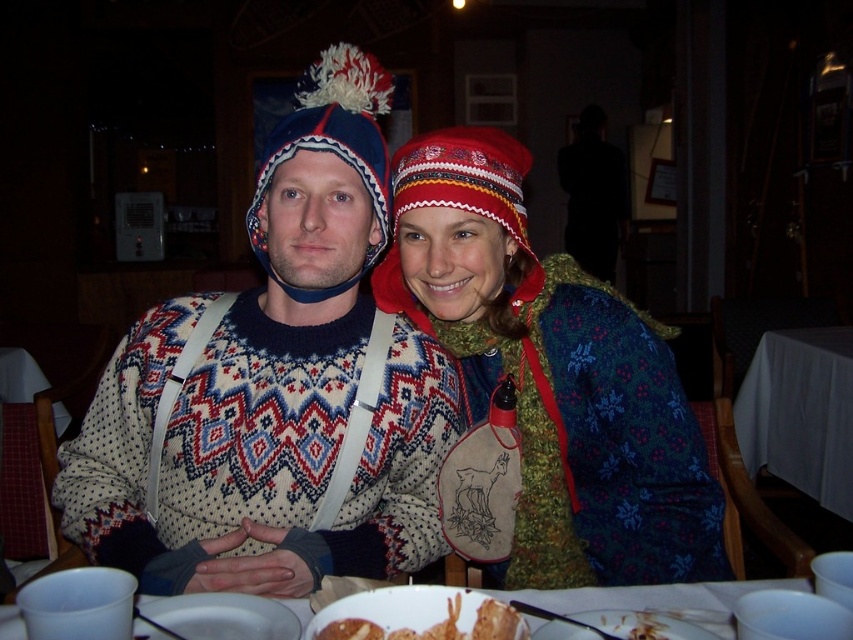
You are a photographer standing in front of the knitted woolen hat at center. You want to capture a closeup shot of it without using a telephoto lens. Can you move closer than 1 meter to get a better shot?

The knitted woolen hat at center is 1.05 meters away from the viewer. Since you want to move closer than 1 meter, you can move 5 centimeters closer to achieve the desired distance.

Where is the knitted sweater at center located?

The knitted sweater at center is located at point (270, 417).

You are a photographer trying to capture a closeup of the knitted woolen hat at center. Given that your camera focuses best within a radius of 0.2 units from the center point, will the hat be in focus?

The knitted woolen hat at center is located at point (339, 157). The distance from the center is sqrt. Since the focus radius is 0.2 units, the hat will be within the focus area and thus in focus.